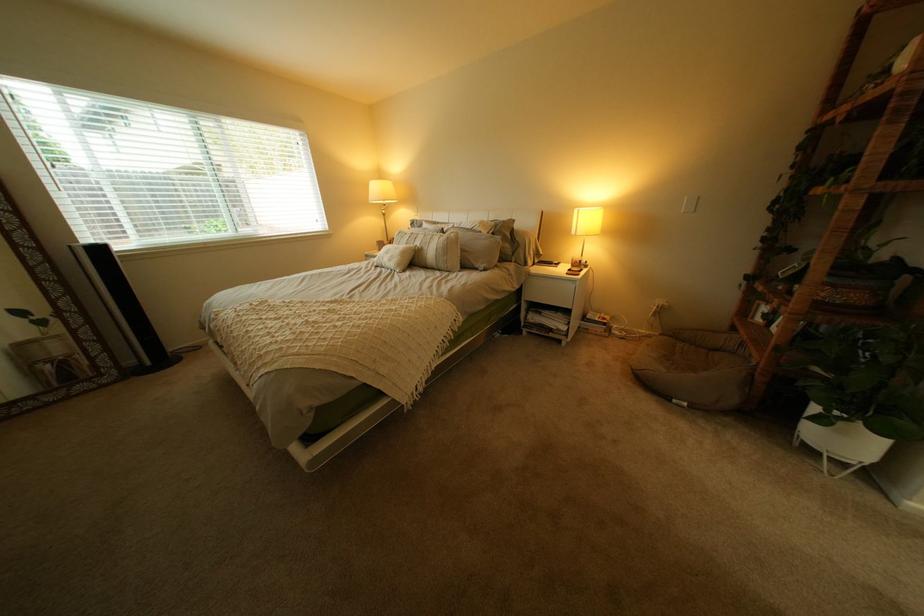
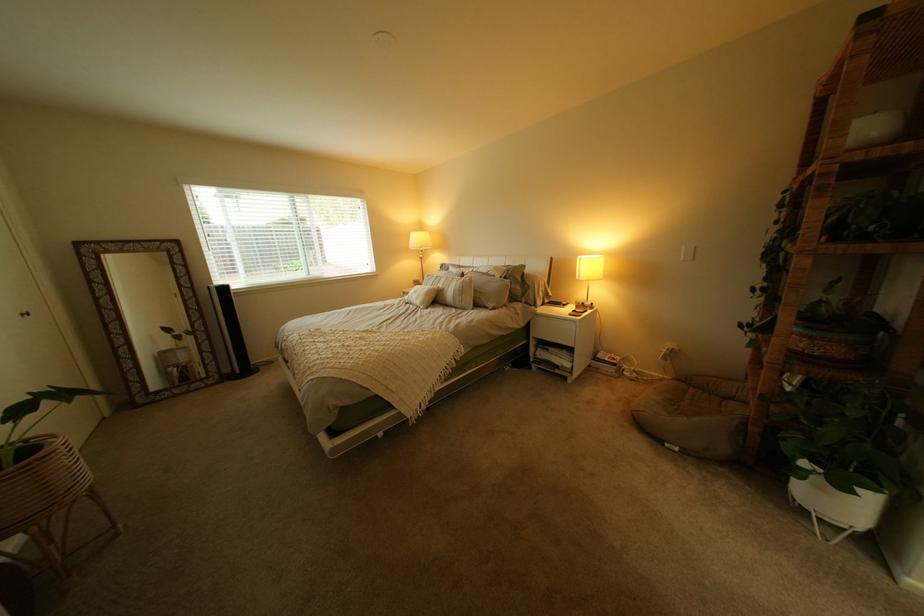
In the second image, find the point that corresponds to (501,270) in the first image.

(509, 310)